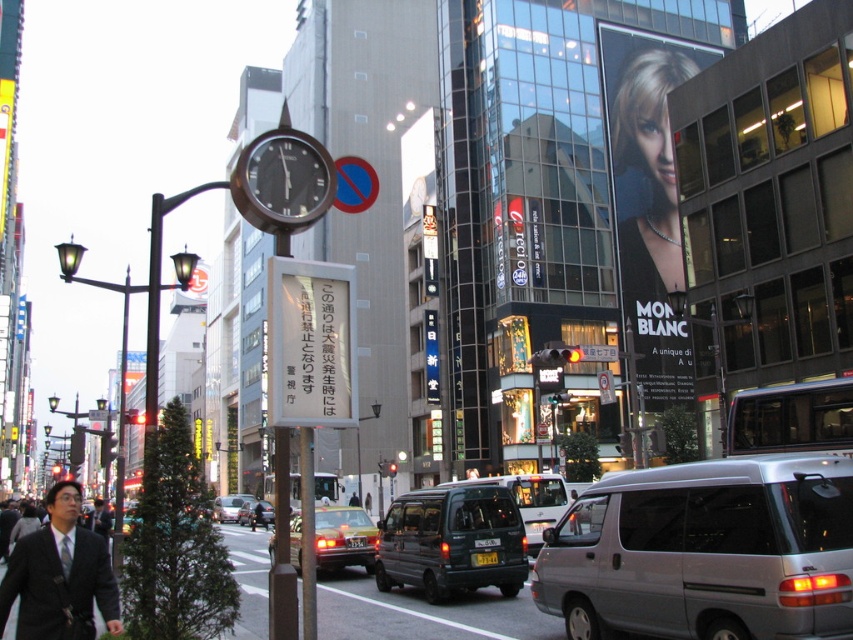
You are a pedestrian standing on the sidewalk and see both the dark gray suit at lower left and the yellow metallic taxi at center. Which object appears bigger in the image?

The dark gray suit at lower left appears bigger in the image because it has a larger size compared to the yellow metallic taxi at center.

You are a delivery person trying to park your motorcycle between the white paper sign at center and the metallic silver sedan at center. Can your motorcycle fit in the space between them?

The white paper sign at center is narrower than the metallic silver sedan at center, so the space between them might be sufficient for your motorcycle. However, since the exact width of the space isn not specified, it depends on the motorcycle size.